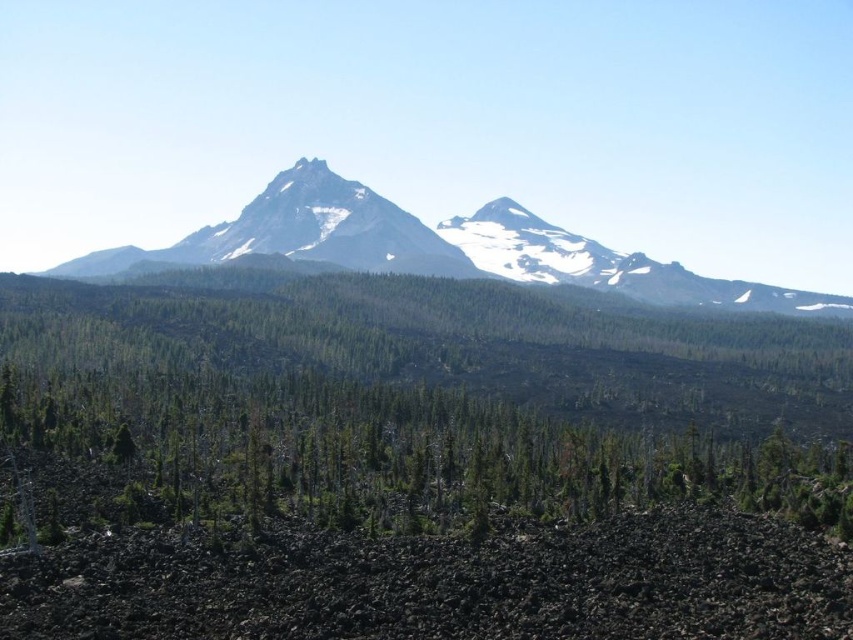
Question: Can you confirm if green matte tree at center is positioned to the right of snowy granite mountain range at center?

Choices:
 (A) no
 (B) yes

Answer: (A)

Question: Can you confirm if green matte tree at center is positioned above snowy granite mountain range at center?

Choices:
 (A) yes
 (B) no

Answer: (B)

Question: Where is green matte tree at center located in relation to snowy granite mountain range at center in the image?

Choices:
 (A) left
 (B) right

Answer: (A)

Question: Which object appears closest to the camera in this image?

Choices:
 (A) green matte tree at center
 (B) snowy granite mountain range at center

Answer: (A)